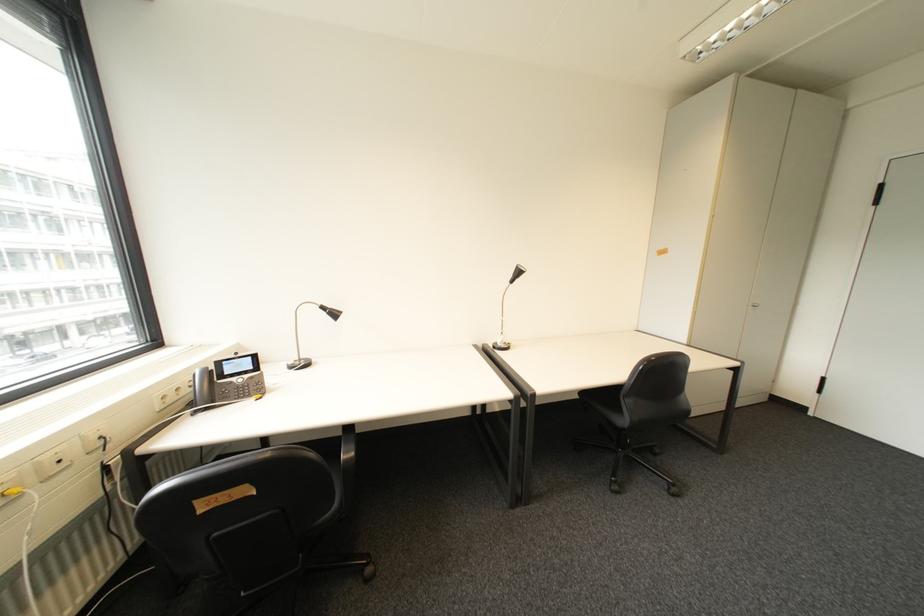
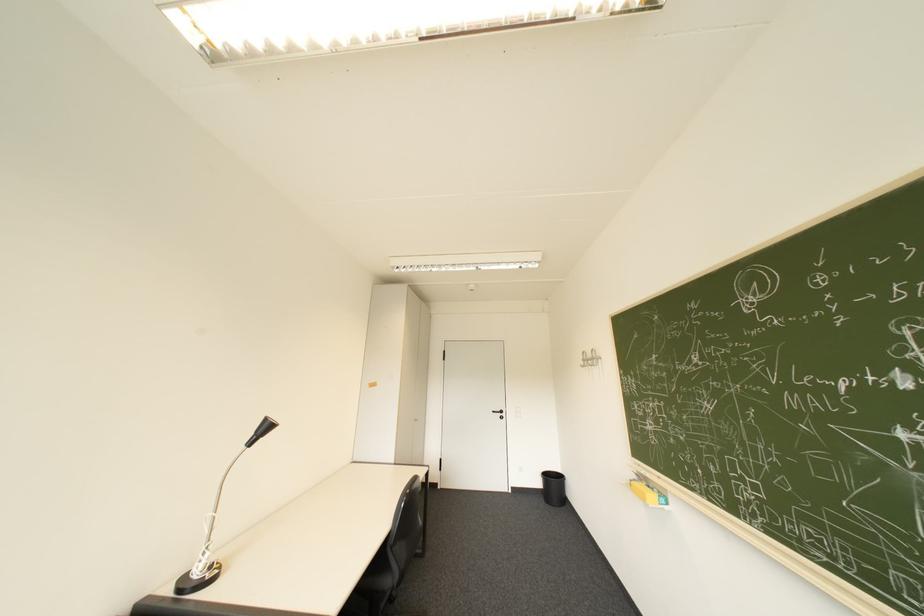
The images are taken continuously from a first-person perspective. In which direction is your viewpoint rotating?

The camera's rotation is toward right-up.